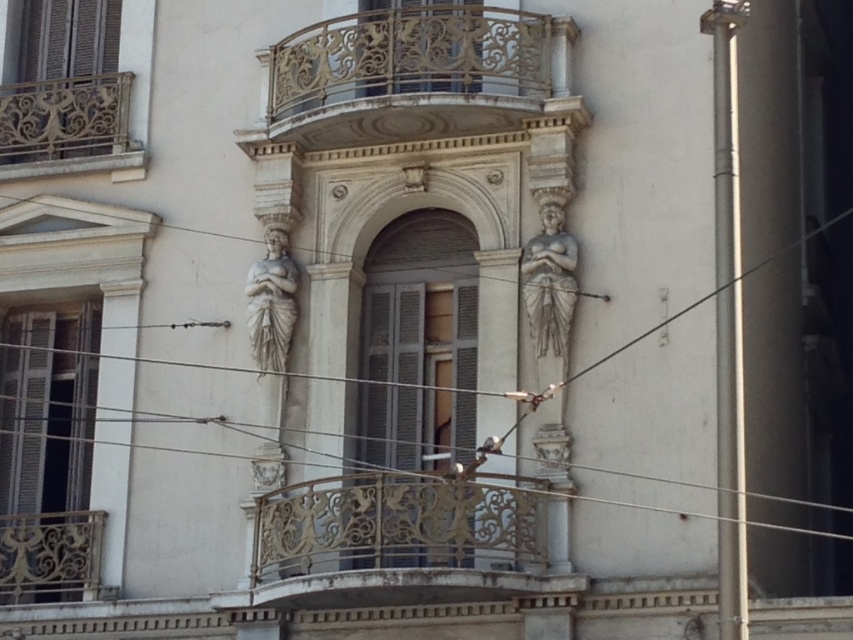
Question: Which point appears farthest from the camera in this image?

Choices:
 (A) (274, 250)
 (B) (300, 577)

Answer: (A)

Question: Based on their relative distances, which object is farther from the gold ornate railing at upper left?

Choices:
 (A) gold ornate railing at center
 (B) gray stone statue at center
 (C) gold ornate railing at upper center

Answer: (A)

Question: Is gold ornate railing at center smaller than gold ornate railing at upper left?

Choices:
 (A) yes
 (B) no

Answer: (A)

Question: Is gold ornate railing at upper left smaller than gray stone statue at center?

Choices:
 (A) yes
 (B) no

Answer: (A)

Question: Which point appears farthest from the camera in this image?

Choices:
 (A) (265, 278)
 (B) (309, 584)

Answer: (A)

Question: Does gold ornate railing at upper left have a smaller size compared to gray stone statue at center?

Choices:
 (A) yes
 (B) no

Answer: (A)